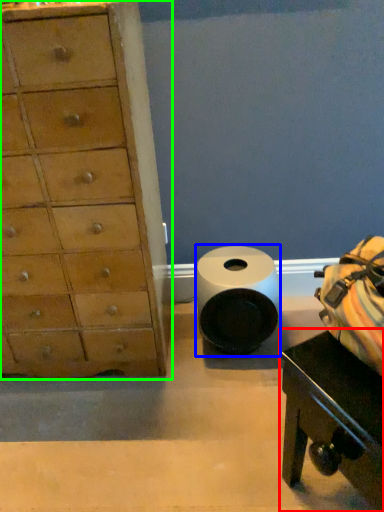
Question: Which is farther away from table (highlighted by a red box)? toilet paper (highlighted by a blue box) or chest of drawers (highlighted by a green box)?

Choices:
 (A) toilet paper
 (B) chest of drawers

Answer: (B)